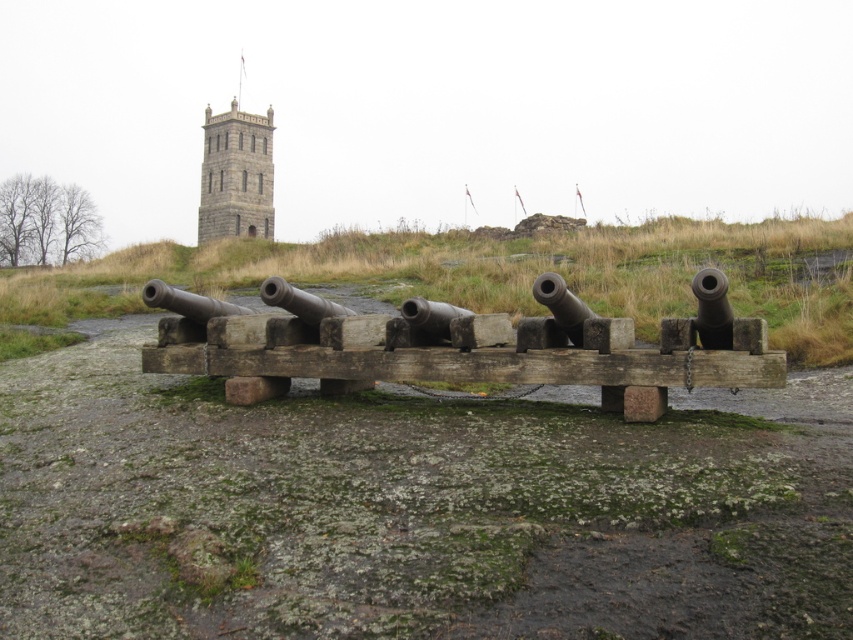
Question: Can you confirm if green grassy at center is smaller than stone tower at upper center?

Choices:
 (A) yes
 (B) no

Answer: (B)

Question: Which of the following is the closest to the observer?

Choices:
 (A) (756, 304)
 (B) (155, 296)
 (C) (262, 186)

Answer: (B)

Question: Does green grassy at center appear over rusty metal cannon at center?

Choices:
 (A) yes
 (B) no

Answer: (A)

Question: Is green grassy at center positioned at the back of rusty metal cannon at center?

Choices:
 (A) no
 (B) yes

Answer: (B)

Question: Which object appears farthest from the camera in this image?

Choices:
 (A) green grassy at center
 (B) rusty metal cannon at center

Answer: (A)

Question: Which object is positioned closest to the rusty metal cannon at center?

Choices:
 (A) stone tower at upper center
 (B) brass polished cannon at center
 (C) green grassy at center

Answer: (B)